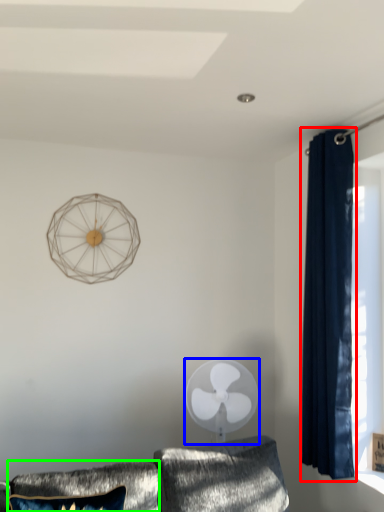
Question: Based on their relative distances, which object is nearer to curtain (highlighted by a red box)? Choose from mechanical fan (highlighted by a blue box) and pillow (highlighted by a green box).

Choices:
 (A) mechanical fan
 (B) pillow

Answer: (A)